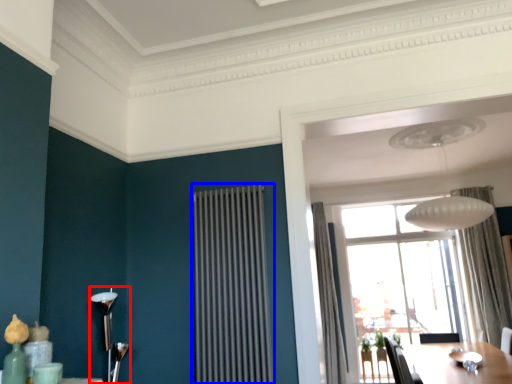
Question: Which of the following is the closest to the observer, lamp (highlighted by a red box) or radiator (highlighted by a blue box)?

Choices:
 (A) lamp
 (B) radiator

Answer: (A)